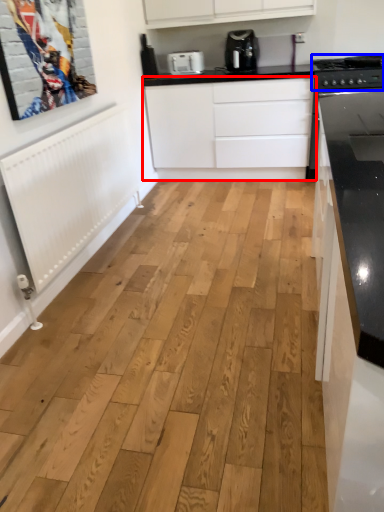
Question: Which object appears farthest to the camera in this image, cabinetry (highlighted by a red box) or stove (highlighted by a blue box)?

Choices:
 (A) cabinetry
 (B) stove

Answer: (A)